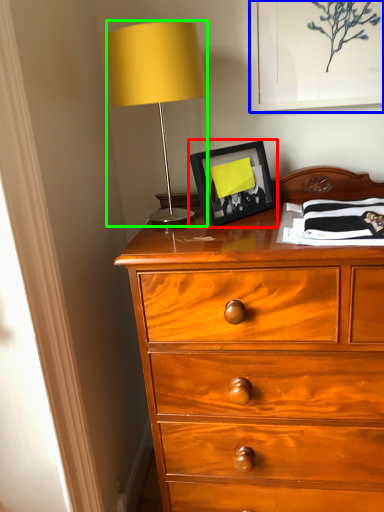
Question: Which is nearer to the picture frame (highlighted by a red box)? picture frame (highlighted by a blue box) or table lamp (highlighted by a green box).

Choices:
 (A) picture frame
 (B) table lamp

Answer: (B)